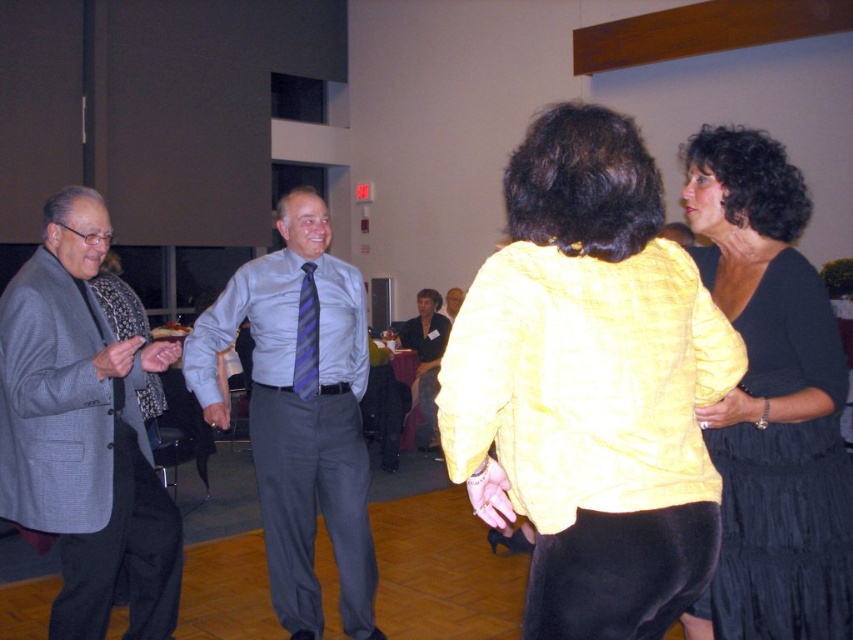
Question: Does gray textured blazer at left have a lesser width compared to purple striped tie at center?

Choices:
 (A) no
 (B) yes

Answer: (A)

Question: Among these objects, which one is farthest from the camera?

Choices:
 (A) purple striped tie at center
 (B) black satin dress at right
 (C) light blue striped tie at center
 (D) gray textured blazer at left

Answer: (C)

Question: In this image, where is gray textured blazer at left located relative to light blue striped tie at center?

Choices:
 (A) right
 (B) left

Answer: (B)

Question: Which point is farther to the camera?

Choices:
 (A) light blue striped tie at center
 (B) black satin dress at right
 (C) purple striped tie at center

Answer: (A)

Question: Which of the following is the closest to the observer?

Choices:
 (A) (32, 404)
 (B) (312, 310)

Answer: (A)

Question: Does gray textured blazer at left have a greater width compared to light blue shirt at center?

Choices:
 (A) no
 (B) yes

Answer: (A)